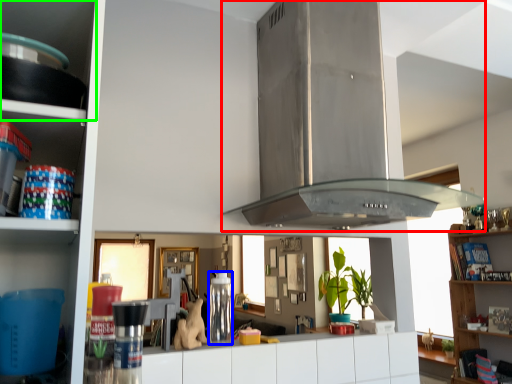
Question: Estimate the real-world distances between objects in this image. Which object is farther from exhaust hood (highlighted by a red box), appliance (highlighted by a blue box) or shelf (highlighted by a green box)?

Choices:
 (A) appliance
 (B) shelf

Answer: (B)